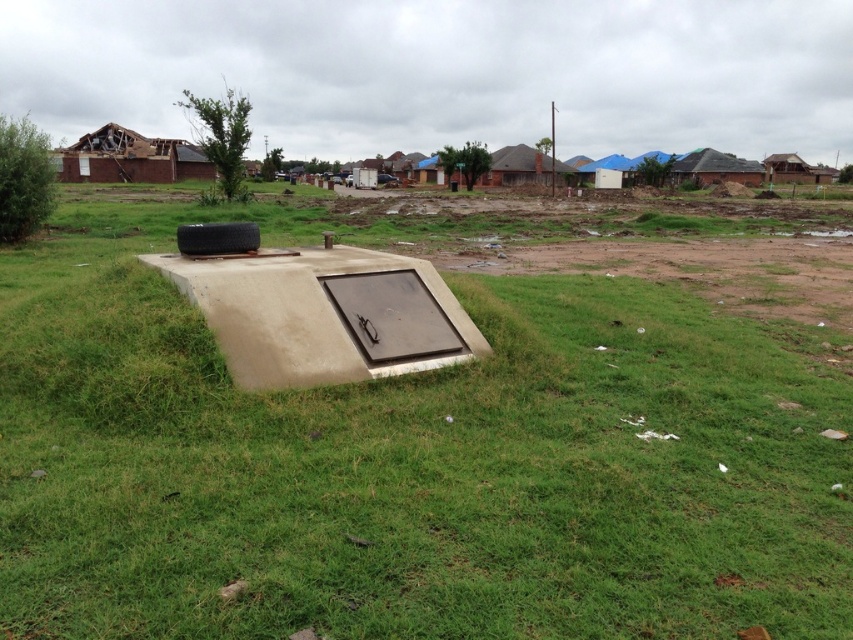
You are a delivery person trying to navigate through the grassy area. You see the concrete at center and the brown corrugated roof at upper right. Which object is closer to the ground?

The concrete at center is located below the brown corrugated roof at upper right, so the concrete at center is closer to the ground.

What is the 2D coordinate of the concrete at center in the image?

The 2D coordinate of the concrete at center is at point (410,458).

You are standing in the middle of the image and want to walk towards the brick house at upper left and the brown corrugated roof at upper right. Which direction should you face to walk towards both of them?

To walk towards both the brick house at upper left and the brown corrugated roof at upper right, you should face towards the upper part of the image since both are located in the upper area.